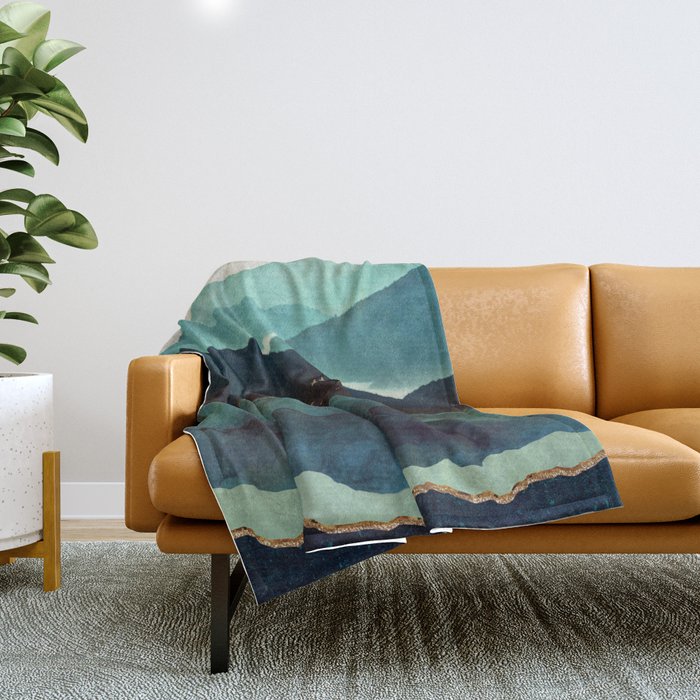
Locate an element on the screen. This screenshot has width=700, height=700. vegan leather couch is located at coordinates (164, 437).